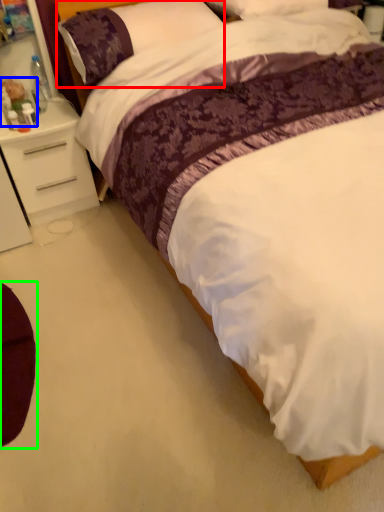
Question: Estimate the real-world distances between objects in this image. Which object is farther from pillow (highlighted by a red box), toy (highlighted by a blue box) or swivel chair (highlighted by a green box)?

Choices:
 (A) toy
 (B) swivel chair

Answer: (B)